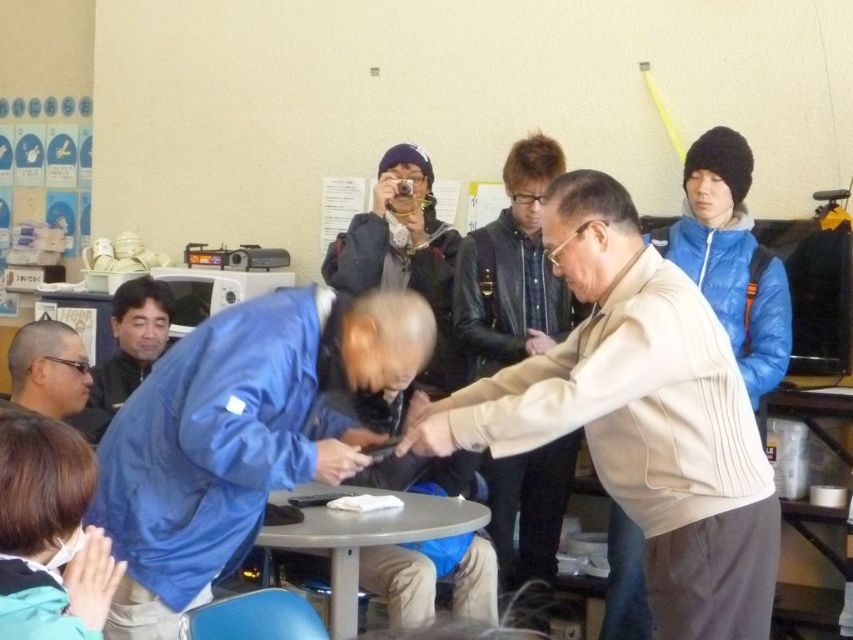
You are standing in the community center and want to reach a specific point to set up a small display. The point is located at coordinates point (412,468). Considering your height is 1.7 meters, will you be able to see over the crowd if you stand at that point?

The distance of point (412,468) from viewer is 3.10 meters. Since the point is 3.10 meters away, and your height is 1.7 meters, you may not be able to see over the crowd clearly due to the distance and possible obstruction by people.

You are organizing a small event at this community center and need to place a large poster on the matte black jacket at center or the gray plastic table at center. Which object would be more suitable for placing the poster based on their sizes?

The matte black jacket at center has a larger size compared to the gray plastic table at center, so it would be more suitable for placing the large poster.

You are organizing a clothing donation drive and need to categorize items by size. You have a beige fabric jacket at center and a light beige sweater at center in front of you. Which item should you place in the large size bin?

The beige fabric jacket at center is larger in size than the light beige sweater at center, so you should place the beige fabric jacket at center in the large size bin.